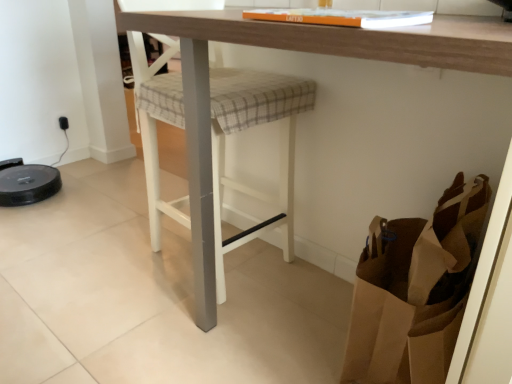
Question: Is wooden table at center looking in the opposite direction of brown paper bag at lower right?

Choices:
 (A) yes
 (B) no

Answer: (A)

Question: Is brown paper bag at lower right located within wooden table at center?

Choices:
 (A) yes
 (B) no

Answer: (A)

Question: Are wooden table at center and brown paper bag at lower right far apart?

Choices:
 (A) no
 (B) yes

Answer: (A)

Question: Does wooden table at center have a lesser height compared to brown paper bag at lower right?

Choices:
 (A) no
 (B) yes

Answer: (A)

Question: Is wooden table at center next to brown paper bag at lower right and touching it?

Choices:
 (A) no
 (B) yes

Answer: (A)

Question: Which is correct: wooden table at center is inside plaid fabric step stool at center, or outside of it?

Choices:
 (A) inside
 (B) outside

Answer: (B)

Question: From the image's perspective, is wooden table at center located above or below plaid fabric step stool at center?

Choices:
 (A) above
 (B) below

Answer: (B)

Question: Is wooden table at center wider or thinner than plaid fabric step stool at center?

Choices:
 (A) wide
 (B) thin

Answer: (A)

Question: From a real-world perspective, is wooden table at center physically located above or below plaid fabric step stool at center?

Choices:
 (A) above
 (B) below

Answer: (B)

Question: In terms of width, does brown paper bag at lower right look wider or thinner when compared to wooden table at center?

Choices:
 (A) thin
 (B) wide

Answer: (A)

Question: Is brown paper bag at lower right in front of or behind wooden table at center in the image?

Choices:
 (A) front
 (B) behind

Answer: (B)

Question: Is brown paper bag at lower right to the left or to the right of wooden table at center in the image?

Choices:
 (A) left
 (B) right

Answer: (B)

Question: Considering the positions of brown paper bag at lower right and wooden table at center in the image, is brown paper bag at lower right bigger or smaller than wooden table at center?

Choices:
 (A) small
 (B) big

Answer: (A)

Question: From the image's perspective, is wooden table at center above or below brown paper bag at lower right?

Choices:
 (A) above
 (B) below

Answer: (A)

Question: In terms of height, does wooden table at center look taller or shorter compared to brown paper bag at lower right?

Choices:
 (A) tall
 (B) short

Answer: (A)